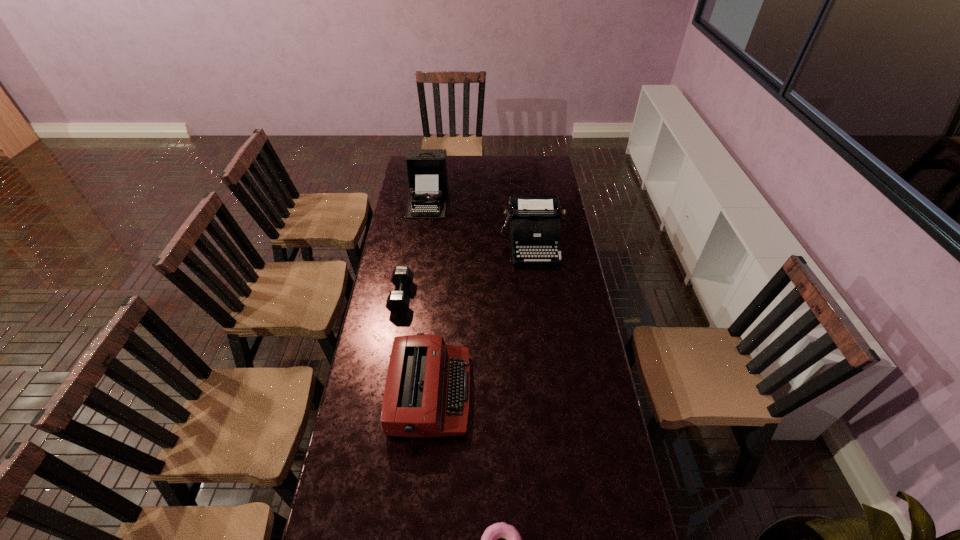
Find the location of `the tallest typewriter`. the tallest typewriter is located at coordinates (426, 168).

The image size is (960, 540). Identify the location of the tallest object. (426, 168).

This screenshot has width=960, height=540. I want to click on the second tallest object, so click(x=535, y=228).

Locate an element on the screen. the second nearest typewriter is located at coordinates (535, 228).

Locate an element on the screen. the nearest typewriter is located at coordinates (427, 390).

You are a GUI agent. You are given a task and a screenshot of the screen. Output one action in this format:
    pyautogui.click(x=<x>, y=<y>)
    Task: Click on the shortest typewriter
    
    Given the screenshot: What is the action you would take?
    pyautogui.click(x=427, y=390)

Identify the location of the third farthest object. The image size is (960, 540). (398, 302).

Image resolution: width=960 pixels, height=540 pixels. I want to click on the second shortest object, so click(x=398, y=302).

Locate an element on the screen. vacant space located 0.170m inside the open case of the tallest object is located at coordinates (421, 241).

Image resolution: width=960 pixels, height=540 pixels. What are the coordinates of `vacant position located 0.300m on the typing side of the rightmost typewriter` in the screenshot? It's located at (541, 319).